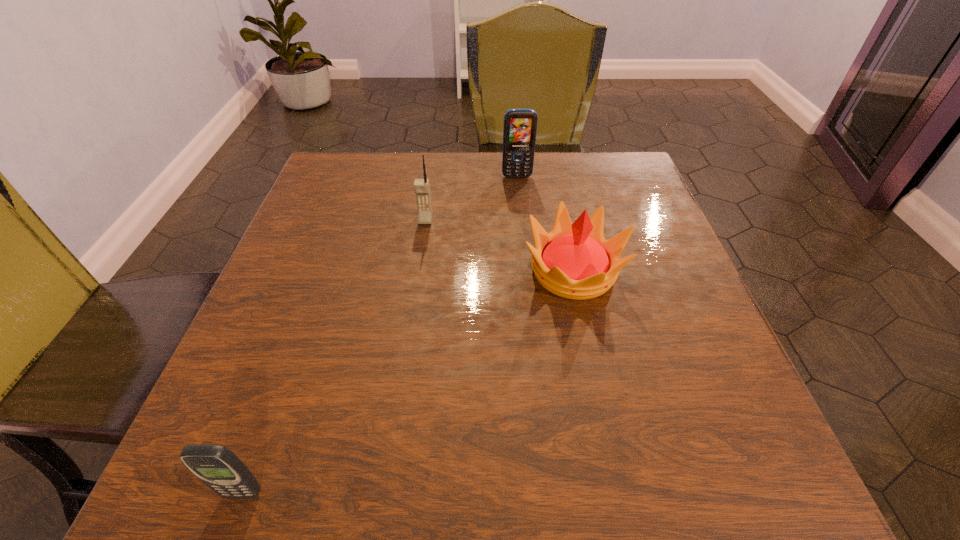
This screenshot has width=960, height=540. Identify the location of the farthest object. (520, 125).

Where is `the rightmost cellular telephone`? the rightmost cellular telephone is located at coordinates (520, 125).

You are a GUI agent. You are given a task and a screenshot of the screen. Output one action in this format:
    pyautogui.click(x=<x>, y=<y>)
    Task: Click on the second farthest object
    This screenshot has width=960, height=540.
    Given the screenshot: What is the action you would take?
    pyautogui.click(x=421, y=186)

This screenshot has height=540, width=960. Identify the location of the second cellular telephone from right to left. (421, 186).

Locate an element on the screen. Image resolution: width=960 pixels, height=540 pixels. the third farthest object is located at coordinates (574, 261).

The width and height of the screenshot is (960, 540). I want to click on the leftmost object, so click(x=220, y=469).

The height and width of the screenshot is (540, 960). I want to click on the nearest object, so click(220, 469).

You are a GUI agent. You are given a task and a screenshot of the screen. Output one action in this format:
    pyautogui.click(x=<x>, y=<y>)
    Task: Click on the free location located on the screen of the rightmost cellular telephone
    The width and height of the screenshot is (960, 540).
    Given the screenshot: What is the action you would take?
    pyautogui.click(x=518, y=191)

The image size is (960, 540). Identify the location of free space located on the front of the second cellular telephone from left to right, where the keypad is located. (420, 260).

At what (x,y) coordinates should I click in order to perform the action: click on blank area located on the back of the crown. Please return your answer as a coordinate pair (x, y). This screenshot has width=960, height=540. Looking at the image, I should click on (548, 152).